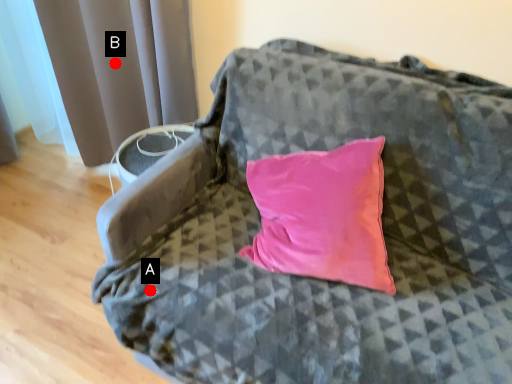
Question: Two points are circled on the image, labeled by A and B beside each circle. Among these points, which one is nearest to the camera?

Choices:
 (A) A is closer
 (B) B is closer

Answer: (A)